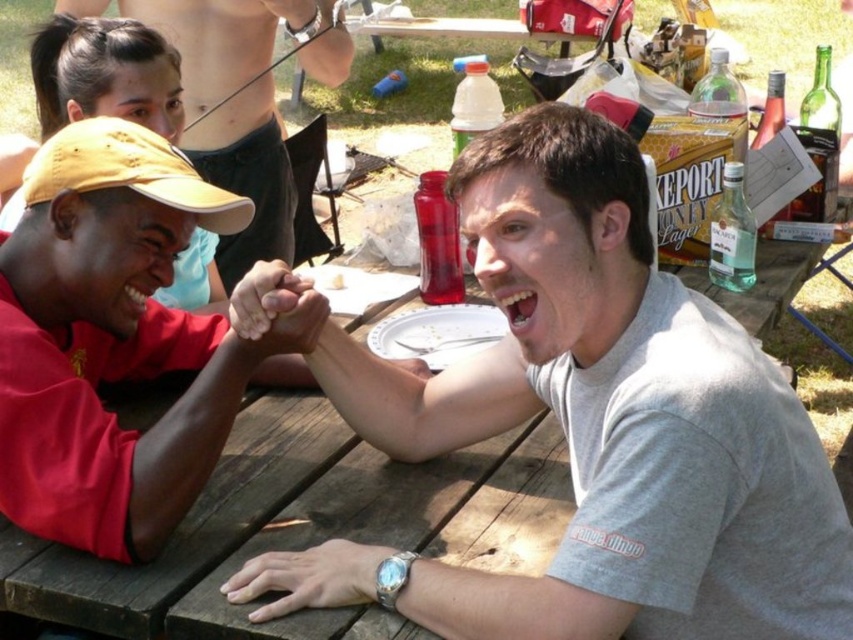
You are standing in front of the picnic table where the arm wrestling match is taking place. You notice two points marked on the table surface. The first point is at coordinates point [314,328] and the second point is at point [184,177]. Which of these two points is closer to you?

Point [314,328] is closer to the camera than point [184,177].

You are standing at the picnic table where the arm wrestling match is happening. You want to take a photo of the point at coordinates point (115,291). If your camera can focus on objects within 1.5 meters, will it be able to capture the point clearly?

The point at point (115,291) is 1.39 meters away from the camera, which is within the 1.5 meters focusing range. Therefore, the camera can capture the point clearly.

You are a photographer positioned at the back of the picnic table. You want to take a photo of the matte red shirt at left and the matte yellow baseball cap at upper left. Which object will appear larger in your photo?

The matte red shirt at left appears larger in the photo because it is closer to the viewer than the matte yellow baseball cap at upper left.